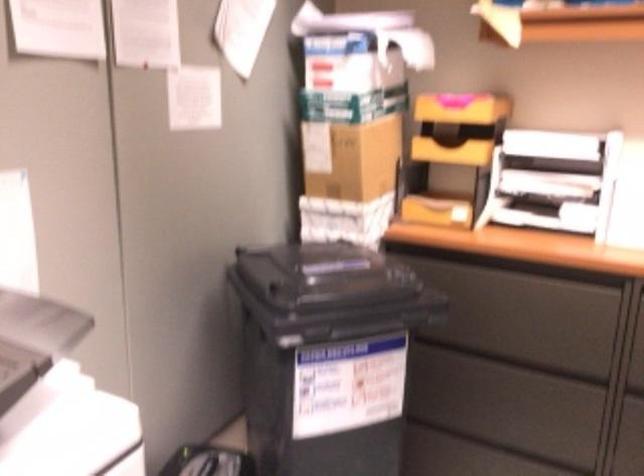
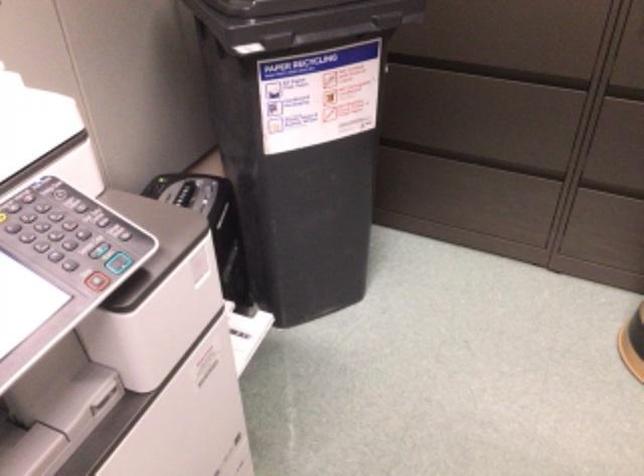
In the second image, find the point that corresponds to point (533, 373) in the first image.

(507, 73)